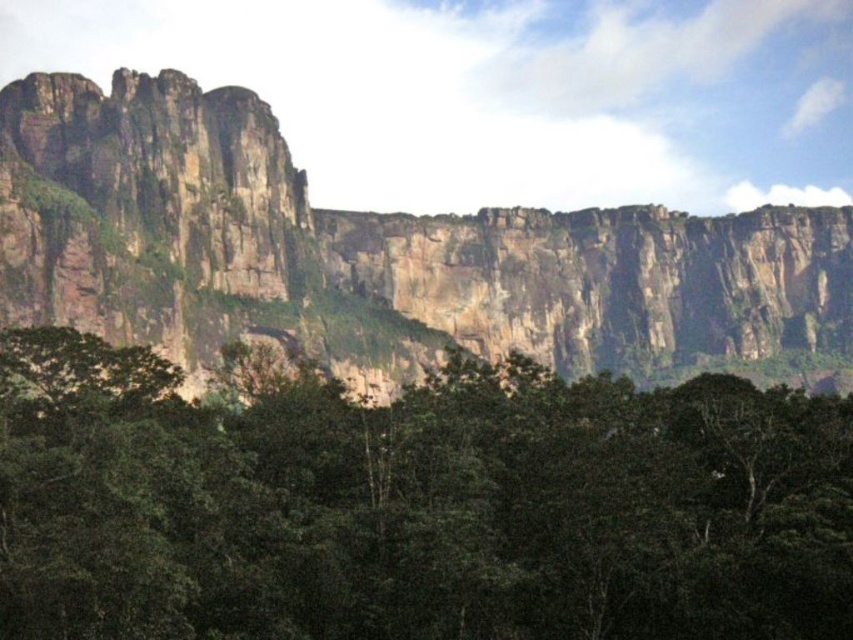
You are a hiker trying to navigate through the green leafy trees at center and the rugged rock cliff at upper center. Which object is closer to the ground?

The green leafy trees at center are closer to the ground since they are located below the rugged rock cliff at upper center.

You are standing in a dense forest area and see a point marked at coordinates (415, 506). According to the scene description, where exactly is this point located?

The point is located on green leafy trees at center.

You are a hiker trying to determine the best path to reach the summit of the rugged rock cliff at upper center. You notice the green leafy trees at center blocking your way. Can you estimate if the trees are shorter than the cliff?

The green leafy trees at center has a lesser height compared to rugged rock cliff at upper center, so yes, the trees are shorter than the cliff, making it possible to navigate around them to reach the summit.